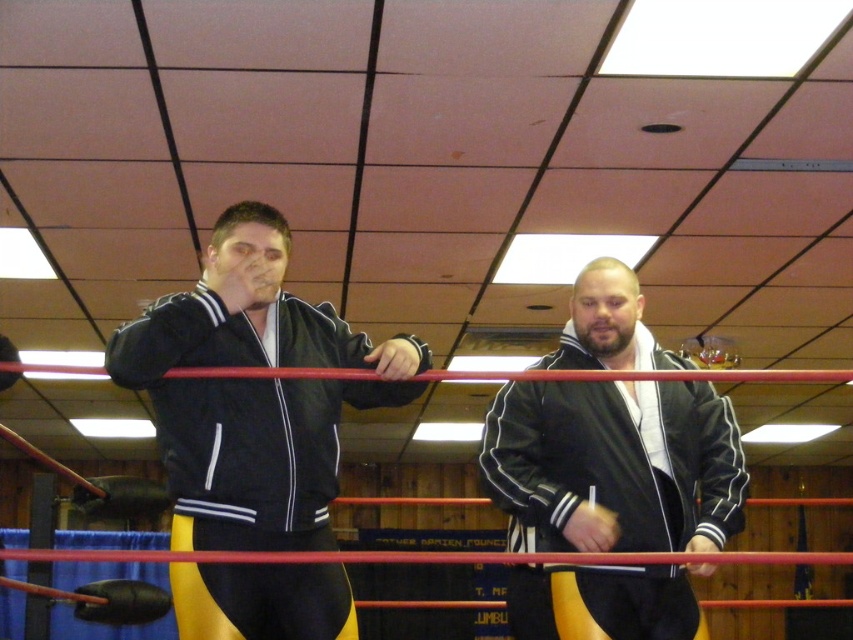
You are standing at the point labeled as point (317, 408) in the wrestling ring. You need to toss a small ball to your teammate who is exactly 1.85 meters away from you. Can you successfully throw the ball to your teammate without it going out of the ring?

Yes, since the point labeled as point (317, 408) and the viewer are 1.85 meters apart, you can successfully throw the ball to your teammate who is exactly that distance away without it going out of the ring.

You are a photographer positioned at the back of the gymnasium. You want to capture a photo of both the black leather jacket at center and the black leather boxing glove at left in the same frame. Based on their sizes in the image, which object should you focus on first to ensure both are in focus?

The black leather jacket at center is much taller than the black leather boxing glove at left, so you should focus on the black leather jacket at center first to ensure both are in focus since it is larger and further away.

You are a photographer positioned at the center of the wrestling ring. You notice two points marked in the scene. Which point is closer to you, point (236, 490) or point (1, 371)?

Point (1, 371) is closer to you because it is less further to the viewer than point (236, 490).